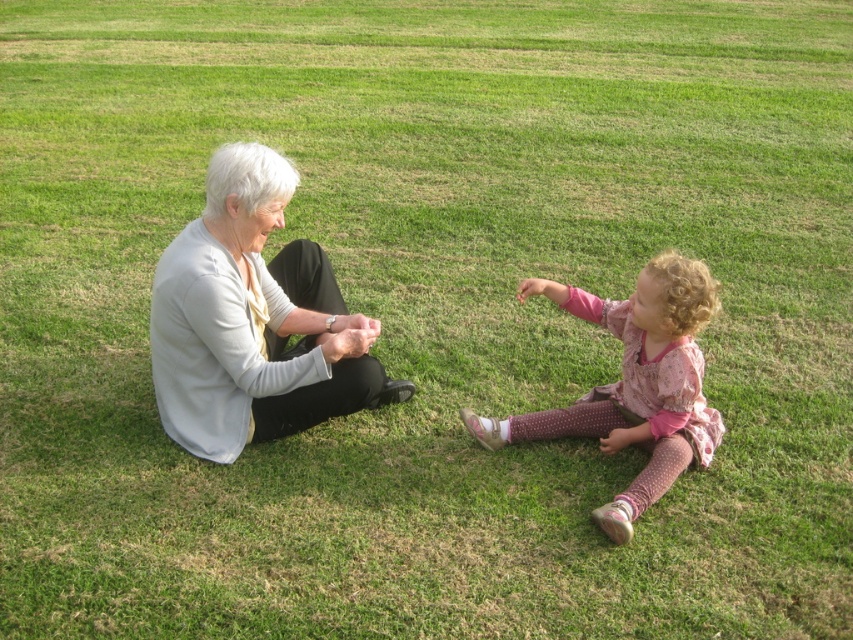
Who is lower down, white matte sweater at left or pink dotted fabric at lower right?

pink dotted fabric at lower right

Is point (213, 376) closer to camera compared to point (664, 371)?

No.

Find the location of a particular element. This screenshot has height=640, width=853. white matte sweater at left is located at coordinates (253, 321).